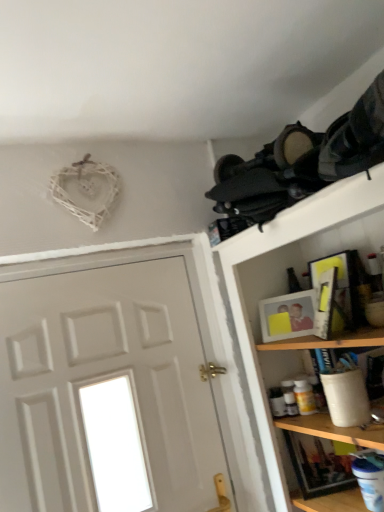
Locate an element on the screen. The height and width of the screenshot is (512, 384). white painted wood door at left is located at coordinates (107, 393).

Identify the location of matte yellow picture frame at upper right, the 2th picture frame when ordered from back to front. (339, 287).

Is white painted wood door at left wider than wooden shelf at upper right?

Incorrect, the width of white painted wood door at left does not surpass that of wooden shelf at upper right.

Is white painted wood door at left at the right side of wooden shelf at upper right?

No.

Locate an element on the screen. This screenshot has height=512, width=384. shelf in front of the white painted wood door at left is located at coordinates (286, 291).

How distant is white painted wood door at left from wooden shelf at upper right?

The distance of white painted wood door at left from wooden shelf at upper right is 19.16 inches.

Based on their sizes in the image, would you say matte yellow picture frame at upper right, the 2th picture frame when ordered from back to front, is bigger or smaller than white painted wood door at left?

matte yellow picture frame at upper right, the 2th picture frame when ordered from back to front, is smaller than white painted wood door at left.

From the image's perspective, would you say matte yellow picture frame at upper right, the 2th picture frame when ordered from back to front, is positioned over white painted wood door at left?

Indeed, from the image's perspective, matte yellow picture frame at upper right, the 2th picture frame when ordered from back to front, is shown above white painted wood door at left.

Is matte yellow picture frame at upper right, the 2th picture frame when ordered from back to front, completely or partially outside of white painted wood door at left?

matte yellow picture frame at upper right, the 2th picture frame when ordered from back to front, lies outside white painted wood door at left's area.

Can you see matte yellow picture frame at upper right, the 2th picture frame when ordered from back to front, touching white painted wood door at left?

No.

Between matte white picture frame at upper right, the second picture frame viewed from the front, and white painted wood door at left, which one has larger size?

With larger size is white painted wood door at left.

Can you tell me how much matte white picture frame at upper right, the second picture frame viewed from the front, and white painted wood door at left differ in facing direction?

47.5 degrees separate the facing orientations of matte white picture frame at upper right, the second picture frame viewed from the front, and white painted wood door at left.

Locate an element on the screen. The image size is (384, 512). picture frame that is the 1st object above the white painted wood door at left (from a real-world perspective) is located at coordinates (287, 316).

Considering the relative sizes of matte white picture frame at upper right, the second picture frame viewed from the front, and white painted wood door at left in the image provided, is matte white picture frame at upper right, the second picture frame viewed from the front, wider than white painted wood door at left?

In fact, matte white picture frame at upper right, the second picture frame viewed from the front, might be narrower than white painted wood door at left.

Looking at this image, is matte white picture frame at upper right, the second picture frame viewed from the front, positioned far away from matte yellow picture frame at upper right, the 2th picture frame when ordered from back to front?

No, matte white picture frame at upper right, the second picture frame viewed from the front, is in close proximity to matte yellow picture frame at upper right, the 2th picture frame when ordered from back to front.

Considering the sizes of objects matte white picture frame at upper right, the first picture frame from the back, and matte yellow picture frame at upper right, which appears as the 1th picture frame when viewed from the front, in the image provided, who is taller, matte white picture frame at upper right, the first picture frame from the back, or matte yellow picture frame at upper right, which appears as the 1th picture frame when viewed from the front,?

matte yellow picture frame at upper right, which appears as the 1th picture frame when viewed from the front, is taller.

From a real-world perspective, is matte white picture frame at upper right, the second picture frame viewed from the front, below matte yellow picture frame at upper right, the 2th picture frame when ordered from back to front?

Correct, in the physical world, matte white picture frame at upper right, the second picture frame viewed from the front, is lower than matte yellow picture frame at upper right, the 2th picture frame when ordered from back to front.

Is matte yellow picture frame at upper right, the 2th picture frame when ordered from back to front, completely or partially inside matte white picture frame at upper right, the second picture frame viewed from the front?

Actually, matte yellow picture frame at upper right, the 2th picture frame when ordered from back to front, is outside matte white picture frame at upper right, the second picture frame viewed from the front.

Choose the correct answer: Is matte white picture frame at upper right, the second picture frame viewed from the front, inside wooden shelf at upper right or outside it?

The correct answer is: inside.

Is matte white picture frame at upper right, the first picture frame from the back, facing away from wooden shelf at upper right?

Correct, matte white picture frame at upper right, the first picture frame from the back, is looking away from wooden shelf at upper right.

Consider the image. From a real-world perspective, which is physically above, matte white picture frame at upper right, the first picture frame from the back, or wooden shelf at upper right?

matte white picture frame at upper right, the first picture frame from the back.

From their relative heights in the image, would you say wooden shelf at upper right is taller or shorter than matte yellow picture frame at upper right, which appears as the 1th picture frame when viewed from the front?

Clearly, wooden shelf at upper right is taller compared to matte yellow picture frame at upper right, which appears as the 1th picture frame when viewed from the front.

Is wooden shelf at upper right thinner than matte yellow picture frame at upper right, which appears as the 1th picture frame when viewed from the front?

Answer: In fact, wooden shelf at upper right might be wider than matte yellow picture frame at upper right, which appears as the 1th picture frame when viewed from the front.

Which object is more forward, wooden shelf at upper right or matte yellow picture frame at upper right, the 2th picture frame when ordered from back to front?

wooden shelf at upper right is more forward.

Which point is more distant from viewer, (365, 234) or (352, 295)?

The point (365, 234) is more distant.

Which is more to the left, matte yellow picture frame at upper right, the 2th picture frame when ordered from back to front, or wooden shelf at upper right?

Positioned to the left is matte yellow picture frame at upper right, the 2th picture frame when ordered from back to front.

From the image's perspective, which one is positioned higher, matte yellow picture frame at upper right, the 2th picture frame when ordered from back to front, or wooden shelf at upper right?

matte yellow picture frame at upper right, the 2th picture frame when ordered from back to front.

Considering the points (350, 264) and (256, 301), which point is behind, point (350, 264) or point (256, 301)?

Positioned behind is point (256, 301).

Would you say wooden shelf at upper right is part of matte yellow picture frame at upper right, the 2th picture frame when ordered from back to front,'s contents?

Actually, wooden shelf at upper right is outside matte yellow picture frame at upper right, the 2th picture frame when ordered from back to front.

At what (x,y) coordinates should I click in order to perform the action: click on door below the wooden shelf at upper right (from the image's perspective). Please return your answer as a coordinate pair (x, y). The height and width of the screenshot is (512, 384). Looking at the image, I should click on (107, 393).

Locate an element on the screen. door beneath the matte yellow picture frame at upper right, the 2th picture frame when ordered from back to front (from a real-world perspective) is located at coordinates (107, 393).

Estimate the real-world distances between objects in this image. Which object is further from black fabric backpacks at upper right, matte yellow picture frame at upper right, which appears as the 1th picture frame when viewed from the front, or wooden shelf at upper right?

matte yellow picture frame at upper right, which appears as the 1th picture frame when viewed from the front, is positioned further to the anchor black fabric backpacks at upper right.

When comparing their distances from matte yellow picture frame at upper right, the 2th picture frame when ordered from back to front, does matte white picture frame at upper right, the first picture frame from the back, or black fabric backpacks at upper right seem closer?

matte white picture frame at upper right, the first picture frame from the back, is closer to matte yellow picture frame at upper right, the 2th picture frame when ordered from back to front.

From the image, which object appears to be farther from black fabric backpacks at upper right, matte white picture frame at upper right, the second picture frame viewed from the front, or matte yellow picture frame at upper right, the 2th picture frame when ordered from back to front?

The object further to black fabric backpacks at upper right is matte white picture frame at upper right, the second picture frame viewed from the front.

From the picture: From the image, which object appears to be farther from matte yellow picture frame at upper right, which appears as the 1th picture frame when viewed from the front, white painted wood door at left or matte white picture frame at upper right, the second picture frame viewed from the front?

white painted wood door at left is positioned further to the anchor matte yellow picture frame at upper right, which appears as the 1th picture frame when viewed from the front.

Which object lies nearer to the anchor point black fabric backpacks at upper right, white painted wood door at left or wooden shelf at upper right?

wooden shelf at upper right is positioned closer to the anchor black fabric backpacks at upper right.

Based on the photo, based on their spatial positions, is white painted wood door at left or black fabric backpacks at upper right further from wooden shelf at upper right?

white painted wood door at left lies further to wooden shelf at upper right than the other object.

Consider the image. Which object lies further to the anchor point matte yellow picture frame at upper right, which appears as the 1th picture frame when viewed from the front, matte white picture frame at upper right, the second picture frame viewed from the front, or white painted wood door at left?

white painted wood door at left lies further to matte yellow picture frame at upper right, which appears as the 1th picture frame when viewed from the front, than the other object.

Consider the image. From the image, which object appears to be nearer to white painted wood door at left, matte yellow picture frame at upper right, which appears as the 1th picture frame when viewed from the front, or black fabric backpacks at upper right?

black fabric backpacks at upper right lies closer to white painted wood door at left than the other object.

Identify the location of picture frame positioned between wooden shelf at upper right and matte white picture frame at upper right, the first picture frame from the back, from near to far. Image resolution: width=384 pixels, height=512 pixels. (339, 287).

The width and height of the screenshot is (384, 512). I want to click on picture frame that lies between black fabric backpacks at upper right and matte white picture frame at upper right, the first picture frame from the back, from top to bottom, so pos(339,287).

Locate an element on the screen. picture frame between white painted wood door at left and matte yellow picture frame at upper right, which appears as the 1th picture frame when viewed from the front is located at coordinates (287, 316).

At what (x,y) coordinates should I click in order to perform the action: click on shelf that lies between black fabric backpacks at upper right and white painted wood door at left from top to bottom. Please return your answer as a coordinate pair (x, y). Looking at the image, I should click on (286, 291).